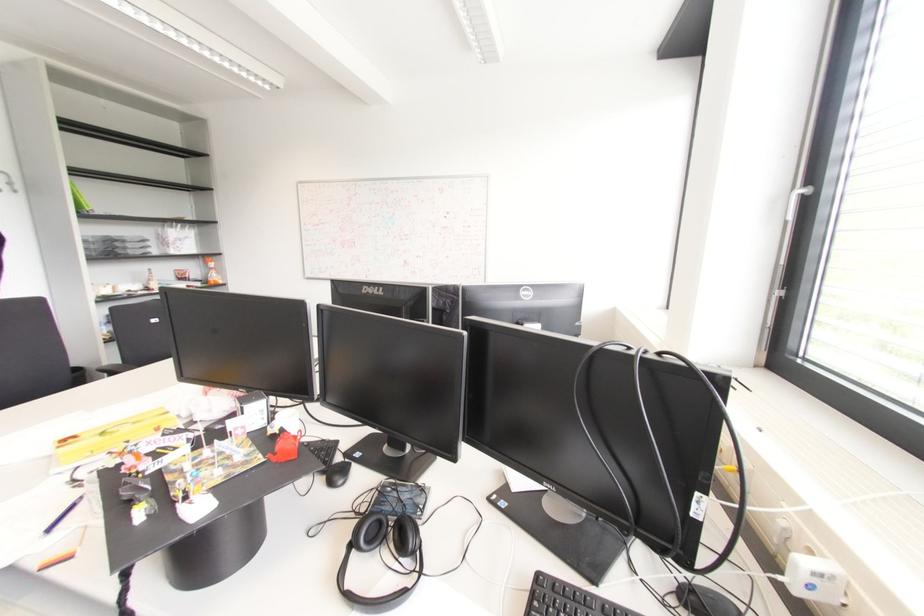
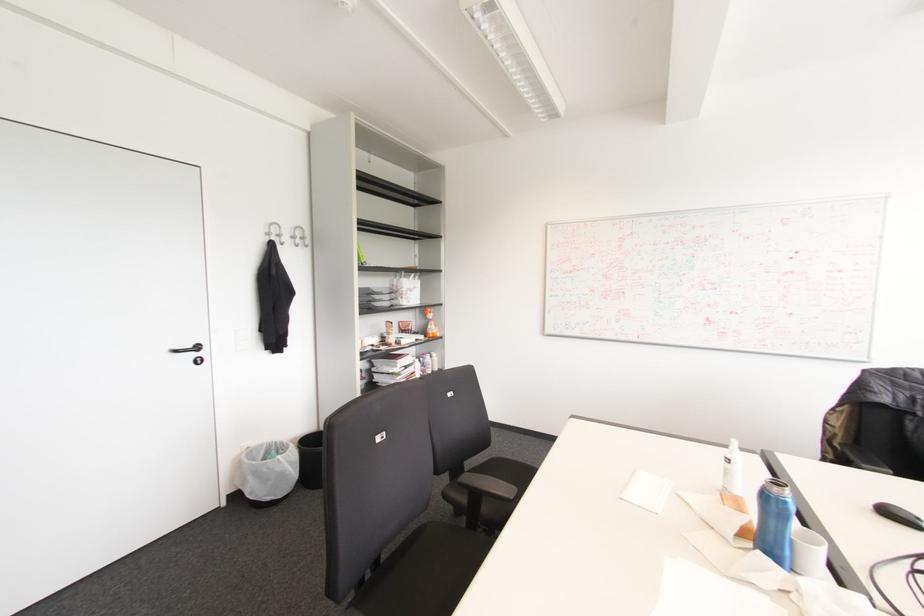
Question: Which direction would the cameraman need to move to produce the second image? Reply with the corresponding letter.

Choices:
 (A) Left
 (B) Right
 (C) Forward
 (D) Backward

Answer: (A)